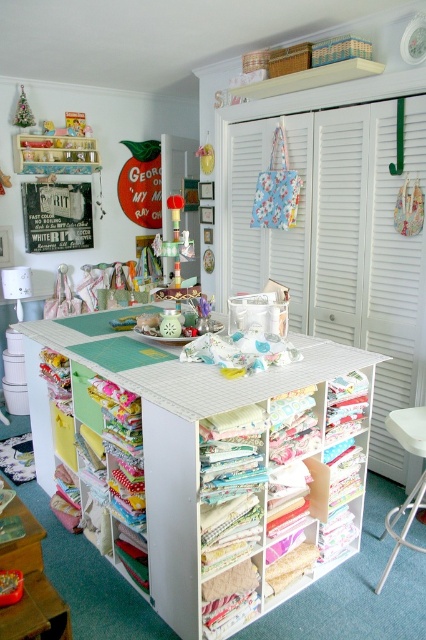
Question: Does white plastic stool at lower right lie behind translucent plastic toy at center?

Choices:
 (A) yes
 (B) no

Answer: (B)

Question: Does white fabric-covered table at center have a larger size compared to metallic silver sign at upper left?

Choices:
 (A) no
 (B) yes

Answer: (B)

Question: Estimate the real-world distances between objects in this image. Which object is farther from the metallic silver sign at upper left?

Choices:
 (A) translucent plastic toy at center
 (B) white fabric-covered table at center
 (C) white plastic stool at lower right
 (D) yellow fabric drawer at lower left

Answer: (C)

Question: Does metallic silver sign at upper left appear on the left side of white plastic stool at lower right?

Choices:
 (A) yes
 (B) no

Answer: (A)

Question: Which point is farther to the camera?

Choices:
 (A) translucent plastic toy at center
 (B) white fabric-covered table at center
 (C) metallic silver sign at upper left

Answer: (A)

Question: Estimate the real-world distances between objects in this image. Which object is farther from the white plastic stool at lower right?

Choices:
 (A) white fabric-covered table at center
 (B) translucent plastic toy at center
 (C) yellow fabric drawer at lower left
 (D) metallic silver sign at upper left

Answer: (D)